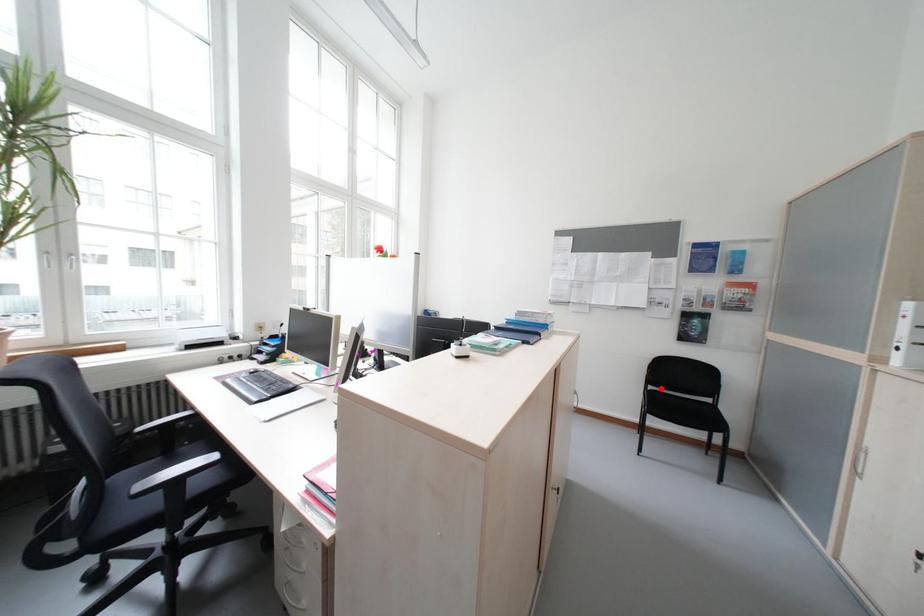
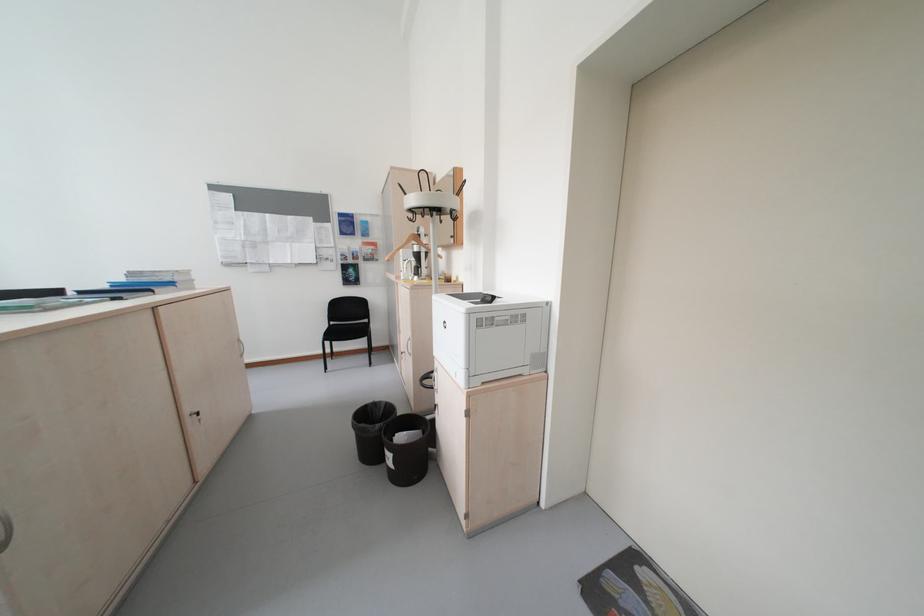
Question: I am providing you with two images of the same scene from different viewpoints. Image1 has a red point marked. In image2, the corresponding 3D location appears at what relative position? Reply with the corresponding letter.

Choices:
 (A) Closer
 (B) Farther

Answer: (A)